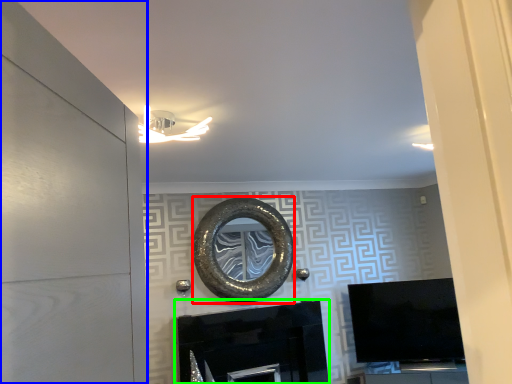
Question: Considering the real-world distances, which object is farthest from oval (highlighted by a red box)? door (highlighted by a blue box) or fireplace (highlighted by a green box)?

Choices:
 (A) door
 (B) fireplace

Answer: (A)